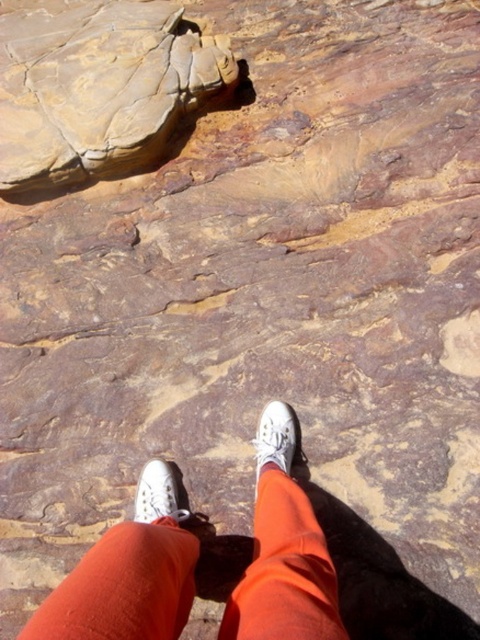
You are a hiker wearing white canvas shoes at center and white canvas shoe at center. You need to step onto a smooth rock nearby. Which of your shoes should you use to ensure stability?

The white canvas shoes at center has a larger size compared to the white canvas shoe at center, so you should use the larger one for better stability on the smooth rock.

You are hiking and need to place your white canvas shoes at center on a stable surface. Is the matte brown rock at upper left a suitable spot to place them?

The matte brown rock at upper left is to the left of white canvas shoes at center, so it is positioned away from the current placement. To place the shoes on the rock, you would need to move them to the left. However, the stability of the rock isn

You are hiking and need to step carefully. You see a matte brown rock at upper left and a white canvas shoe at lower center. Which object is positioned to the left of the other?

The matte brown rock at upper left is positioned to the left of the white canvas shoe at lower center.